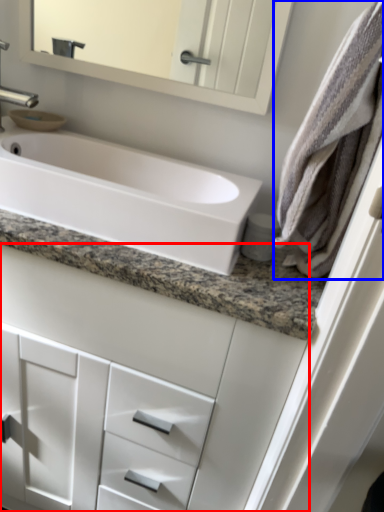
Question: Which object is closer to the camera taking this photo, bathroom cabinet (highlighted by a red box) or bath towel (highlighted by a blue box)?

Choices:
 (A) bathroom cabinet
 (B) bath towel

Answer: (B)